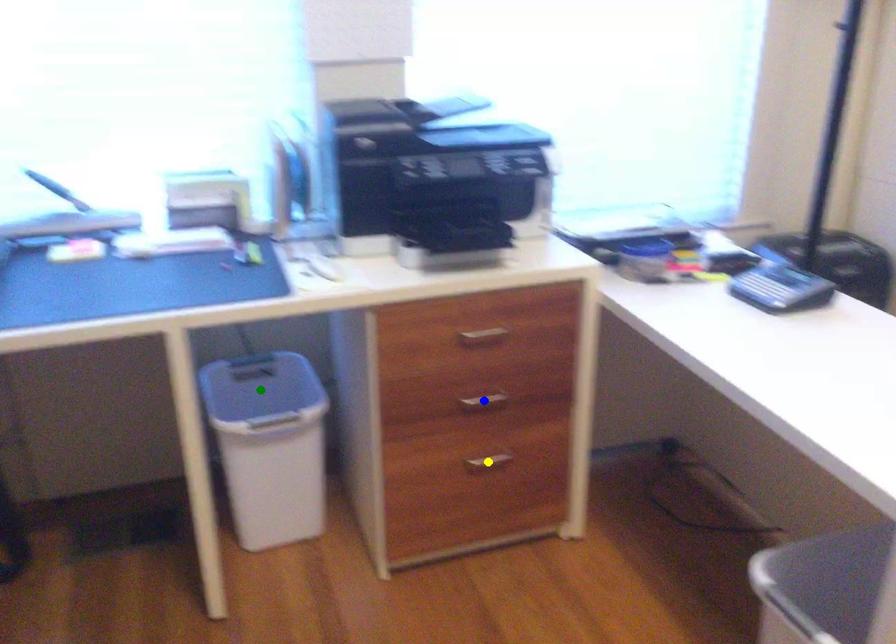
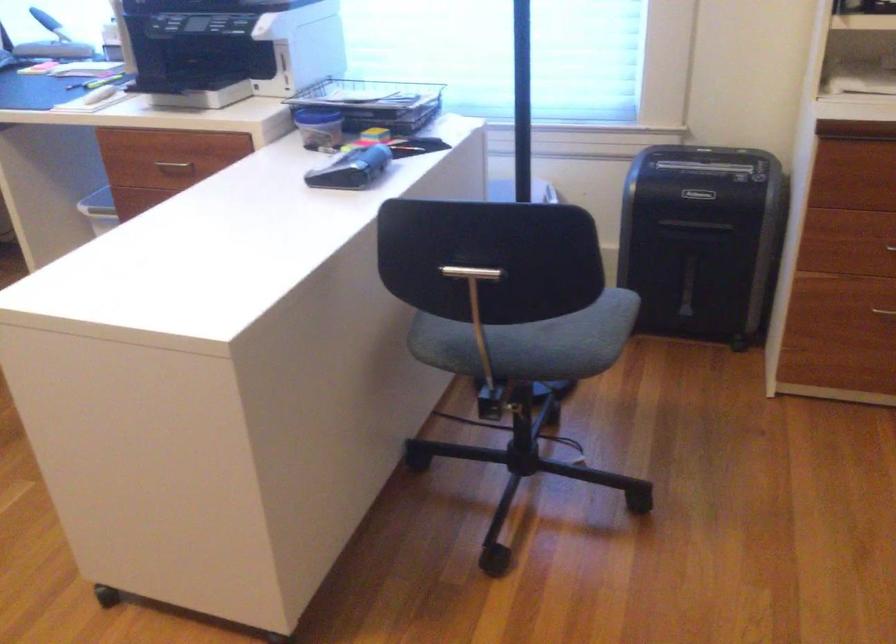
I am providing you with two images of the same scene from different viewpoints. Three points are marked in image1. Which point corresponds to a part or object that is occluded in image2?In image1, three points are marked. Which of them correspond to a part or object that is occluded in image2?Among the three points shown in image1, which one corresponds to a part or object that is no longer visible due to occlusion in image2?

green point, blue point, yellow point